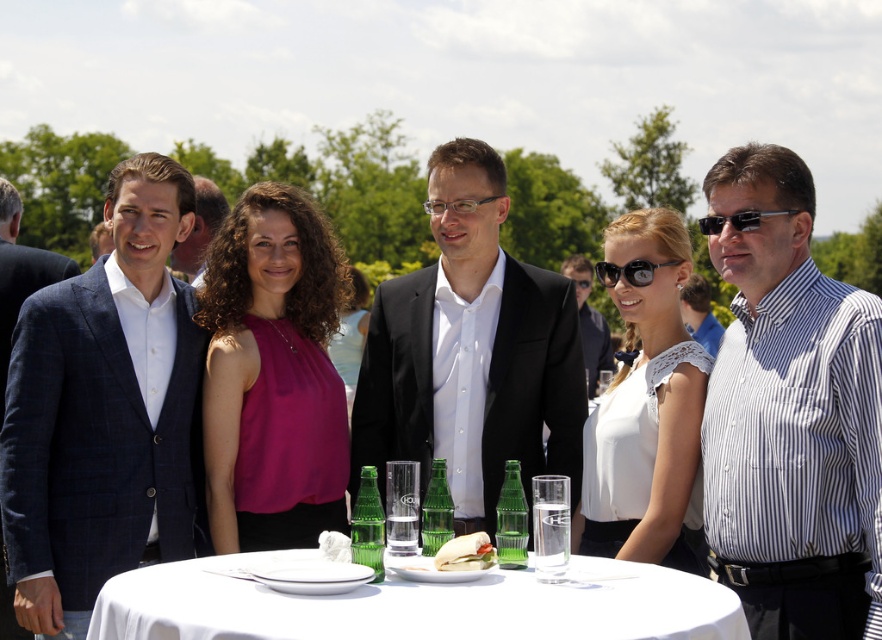
You are standing at the point where the viewer is located in the image. You want to walk directly to the point labeled point (x=735, y=282). How far will you have to walk?

The distance between the viewer and point (x=735, y=282) is 7.80 meters, so you will have to walk 7.80 meters to reach it.